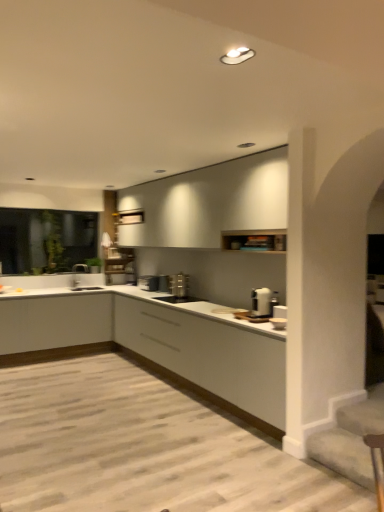
Question: Does black matte sink at center, which is the third appliance from back to front, turn towards white matte cabinet at lower left, arranged as the second cabinetry when viewed from the top?

Choices:
 (A) no
 (B) yes

Answer: (A)

Question: From a real-world perspective, does black matte sink at center, which is the third appliance from back to front, stand above white matte cabinet at lower left, the 2th cabinetry from the bottom?

Choices:
 (A) no
 (B) yes

Answer: (B)

Question: Considering the relative sizes of black matte sink at center, positioned as the third appliance in right-to-left order, and white matte cabinet at lower left, the 2th cabinetry from the bottom, in the image provided, is black matte sink at center, positioned as the third appliance in right-to-left order, bigger than white matte cabinet at lower left, the 2th cabinetry from the bottom,?

Choices:
 (A) yes
 (B) no

Answer: (B)

Question: Can you confirm if black matte sink at center, marked as the 2th appliance in a front-to-back arrangement, is shorter than white matte cabinet at lower left, the 2th cabinetry from the bottom?

Choices:
 (A) no
 (B) yes

Answer: (B)

Question: Can you confirm if black matte sink at center, positioned as the third appliance in right-to-left order, is smaller than white matte cabinet at lower left, arranged as the second cabinetry when viewed from the top?

Choices:
 (A) no
 (B) yes

Answer: (B)

Question: Is satin silver toaster at center, the fourth appliance viewed from the front, wider or thinner than silver metallic tap at center?

Choices:
 (A) wide
 (B) thin

Answer: (A)

Question: From a real-world perspective, is satin silver toaster at center, which is the first appliance in left-to-right order, physically located above or below silver metallic tap at center?

Choices:
 (A) below
 (B) above

Answer: (A)

Question: From the image's perspective, is satin silver toaster at center, acting as the fourth appliance starting from the right, above or below silver metallic tap at center?

Choices:
 (A) below
 (B) above

Answer: (A)

Question: In terms of height, does satin silver toaster at center, the fourth appliance viewed from the front, look taller or shorter compared to silver metallic tap at center?

Choices:
 (A) tall
 (B) short

Answer: (B)

Question: From the image's perspective, is silver metallic tap at center located above or below transparent glass door at left?

Choices:
 (A) above
 (B) below

Answer: (B)

Question: From a real-world perspective, relative to transparent glass door at left, is silver metallic tap at center vertically above or below?

Choices:
 (A) below
 (B) above

Answer: (A)

Question: Looking at the image, does silver metallic tap at center seem bigger or smaller compared to transparent glass door at left?

Choices:
 (A) big
 (B) small

Answer: (B)

Question: Relative to transparent glass door at left, is silver metallic tap at center in front or behind?

Choices:
 (A) behind
 (B) front

Answer: (A)

Question: Considering the relative positions of white matte cabinet at upper center, the 3th cabinetry in the bottom-to-top sequence, and white matte cabinet at center, the 1th cabinetry when ordered from bottom to top, in the image provided, is white matte cabinet at upper center, the 3th cabinetry in the bottom-to-top sequence, to the left or to the right of white matte cabinet at center, the 1th cabinetry when ordered from bottom to top,?

Choices:
 (A) left
 (B) right

Answer: (A)

Question: Is white matte cabinet at upper center, the first cabinetry when ordered from top to bottom, bigger or smaller than white matte cabinet at center, positioned as the third cabinetry in top-to-bottom order?

Choices:
 (A) small
 (B) big

Answer: (A)